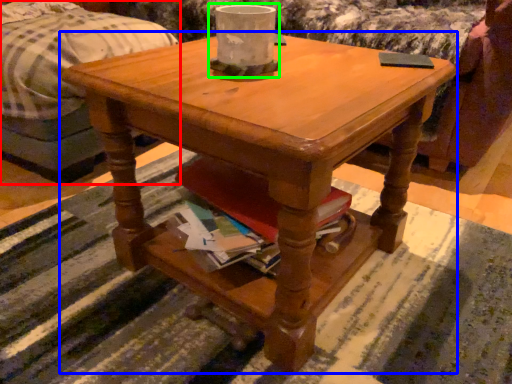
Question: Based on their relative distances, which object is farther from bed (highlighted by a red box)? Choose from coffee table (highlighted by a blue box) and candle holder (highlighted by a green box).

Choices:
 (A) coffee table
 (B) candle holder

Answer: (B)